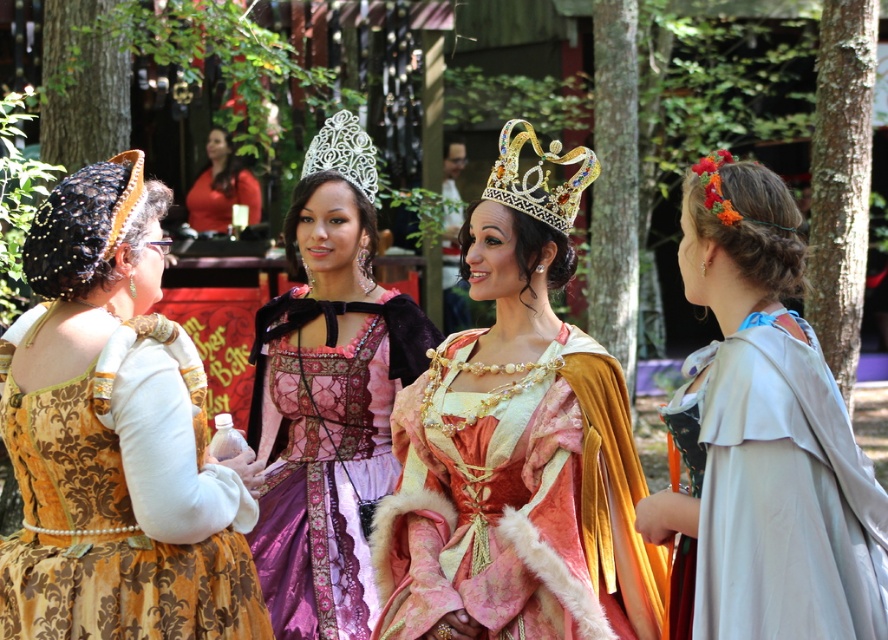
Can you confirm if purple satin dress at center is thinner than gold jeweled crown at center?

Incorrect, purple satin dress at center's width is not less than gold jeweled crown at center's.

Is purple satin dress at center shorter than gold jeweled crown at center?

No, purple satin dress at center is not shorter than gold jeweled crown at center.

Between point (339, 588) and point (567, 198), which one is positioned in front?

Positioned in front is point (567, 198).

Image resolution: width=888 pixels, height=640 pixels. What are the coordinates of `purple satin dress at center` in the screenshot? It's located at (328, 396).

The height and width of the screenshot is (640, 888). What do you see at coordinates (517, 449) in the screenshot? I see `velvet gold crown at center` at bounding box center [517, 449].

Is velvet gold crown at center smaller than floral fabric headband at upper right?

Correct, velvet gold crown at center occupies less space than floral fabric headband at upper right.

Does point (462, 508) lie behind point (720, 196)?

Yes, it is behind point (720, 196).

Locate an element on the screen. velvet gold crown at center is located at coordinates (517, 449).

Which is more to the right, silk blue dress at right or matte red dress at upper center?

From the viewer's perspective, silk blue dress at right appears more on the right side.

How distant is silk blue dress at right from matte red dress at upper center?

A distance of 11.40 meters exists between silk blue dress at right and matte red dress at upper center.

Is point (798, 506) positioned behind point (236, 182)?

No, it is not.

In order to click on silk blue dress at right in this screenshot , I will do `click(764, 442)`.